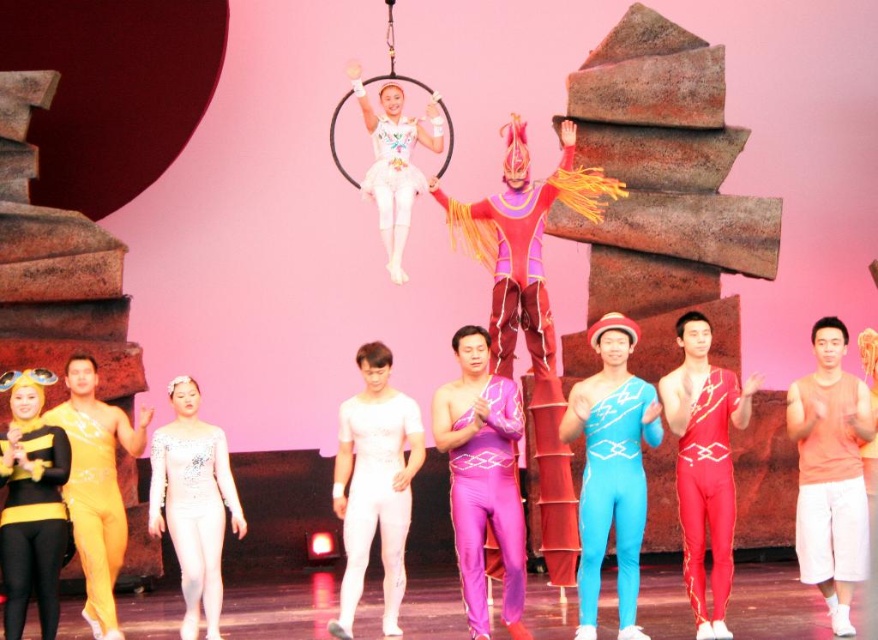
You are a photographer at the back of the stage. You want to capture both the blue spandex jumpsuit at center and the shiny red leotard at center in a single shot. Which performer should you focus on first to ensure both are in frame?

The blue spandex jumpsuit at center is shorter than the shiny red leotard at center, so you should focus on the shiny red leotard at center first to ensure both are in frame.

You are a photographer at the back of the stage. You want to capture both the blue spandex jumpsuit at center and the shiny red leotard at center in a single photo. Which performer should you focus on first to ensure both are in frame?

The blue spandex jumpsuit at center is bigger than the shiny red leotard at center, so you should focus on the blue spandex jumpsuit at center first to ensure both are in frame since it takes up more space.

You are a stagehand preparing to move a 3.5 meter long ladder from the black matte bodysuit at lower left to the yellow spandex bodysuit at left. Based on the space between them, will the ladder fit horizontally between these two performers?

The distance between the black matte bodysuit at lower left and the yellow spandex bodysuit at left is 2.68 meters. Since the ladder is 3.5 meters long, it will not fit horizontally between them as the space is shorter than the ladder.